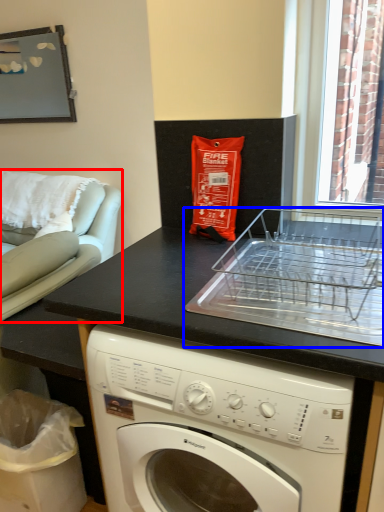
Question: Which of the following is the farthest to the observer, armchair (highlighted by a red box) or appliance (highlighted by a blue box)?

Choices:
 (A) armchair
 (B) appliance

Answer: (A)